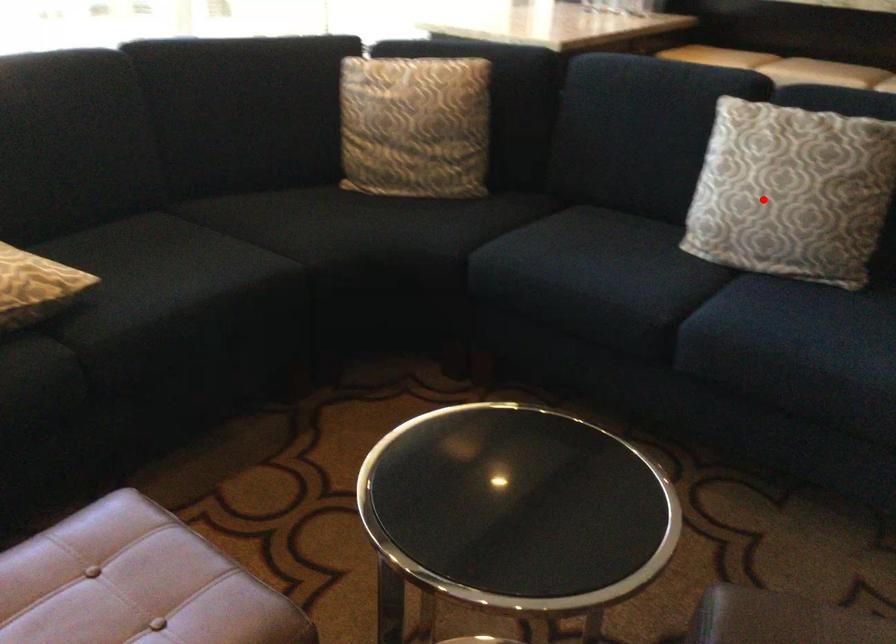
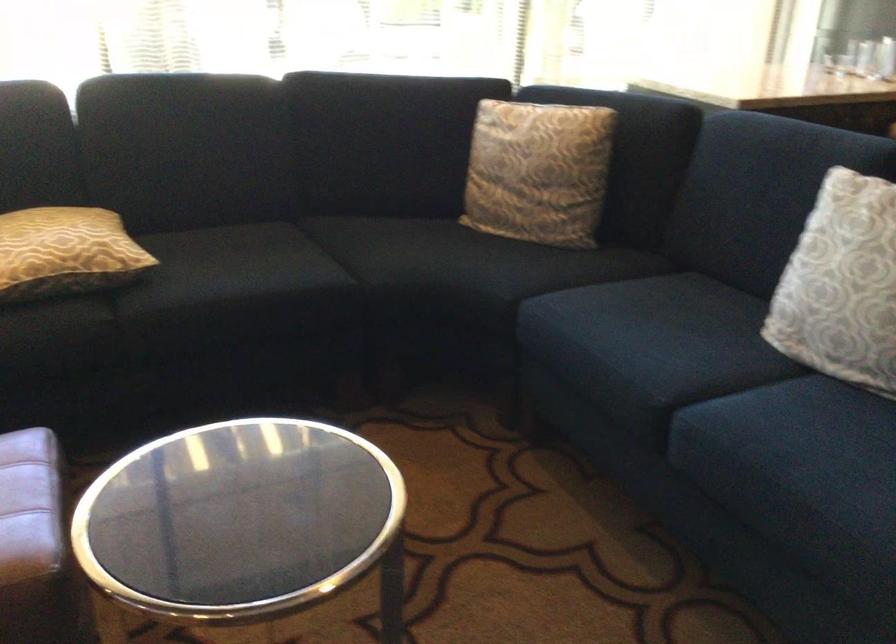
Question: I am providing you with two images of the same scene from different viewpoints. Given a red point in image1, look at the same physical point in image2. Is it:

Choices:
 (A) Closer to the viewpoint
 (B) Farther from the viewpoint

Answer: (A)